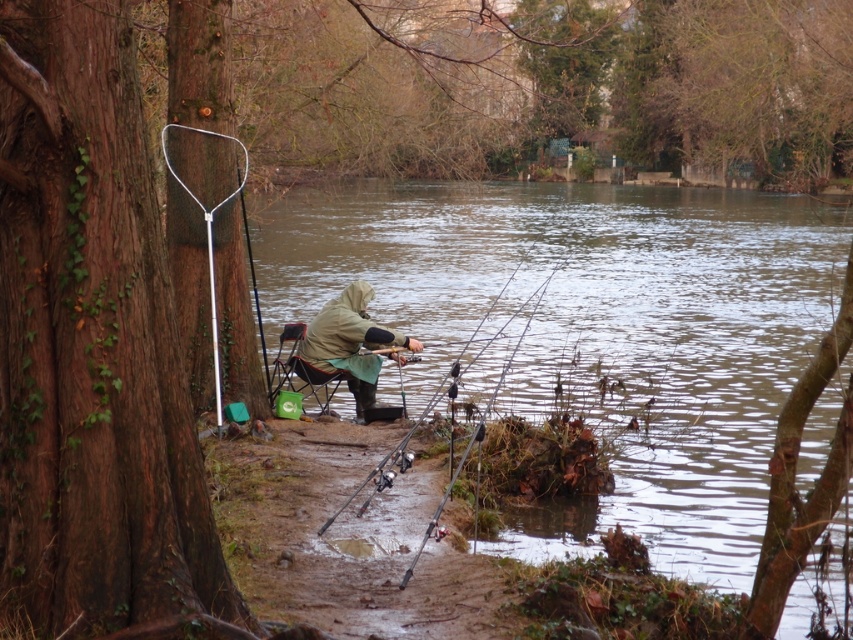
Can you confirm if khaki fabric jacket at center is positioned below black plastic fishing pole at center?

Yes.

Between point (357, 401) and point (500, 372), which one is positioned in front?

Point (357, 401) is in front.

What do you see at coordinates (352, 342) in the screenshot? I see `khaki fabric jacket at center` at bounding box center [352, 342].

Find the location of a particular element. khaki fabric jacket at center is located at coordinates (352, 342).

Is point (618, 202) positioned in front of point (32, 458)?

No, (618, 202) is behind (32, 458).

Which is behind, point (283, 291) or point (22, 211)?

Point (283, 291)

Is point (634, 193) positioned before point (134, 323)?

No, (634, 193) is further to viewer.

You are a GUI agent. You are given a task and a screenshot of the screen. Output one action in this format:
    pyautogui.click(x=<x>, y=<y>)
    Task: Click on the clear water at center
    Image resolution: width=853 pixels, height=640 pixels.
    Given the screenshot: What is the action you would take?
    (x=596, y=330)

You are a GUI agent. You are given a task and a screenshot of the screen. Output one action in this format:
    pyautogui.click(x=<x>, y=<y>)
    Task: Click on the brown rough tree trunk at left
    Image resolution: width=853 pixels, height=640 pixels.
    Given the screenshot: What is the action you would take?
    pyautogui.click(x=91, y=344)

Based on the photo, between brown rough tree trunk at left and black plastic fishing pole at center, which one is positioned lower?

brown rough tree trunk at left is lower down.

Identify the location of brown rough tree trunk at left. This screenshot has height=640, width=853. (91, 344).